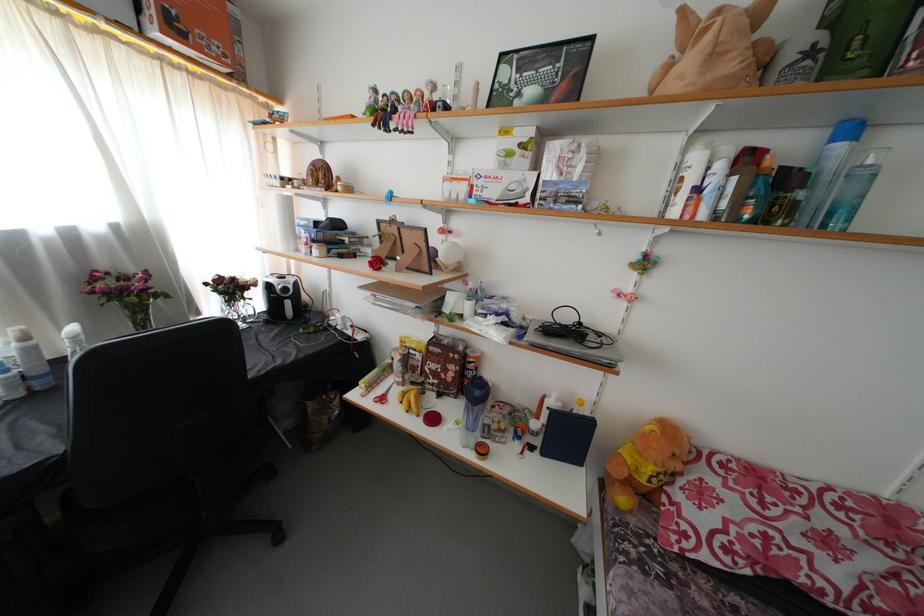
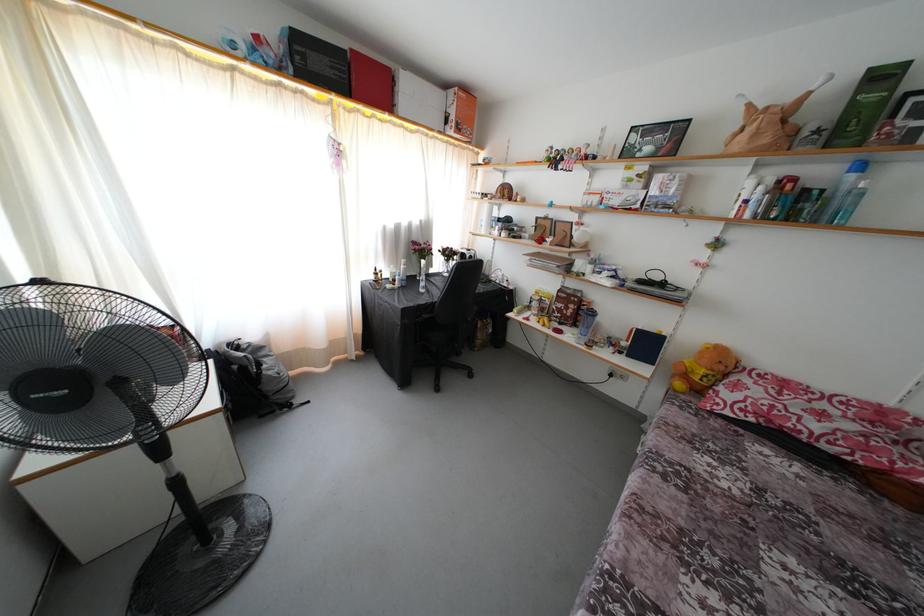
In the second image, find the point that corresponds to point 732,492 in the first image.

(760, 389)